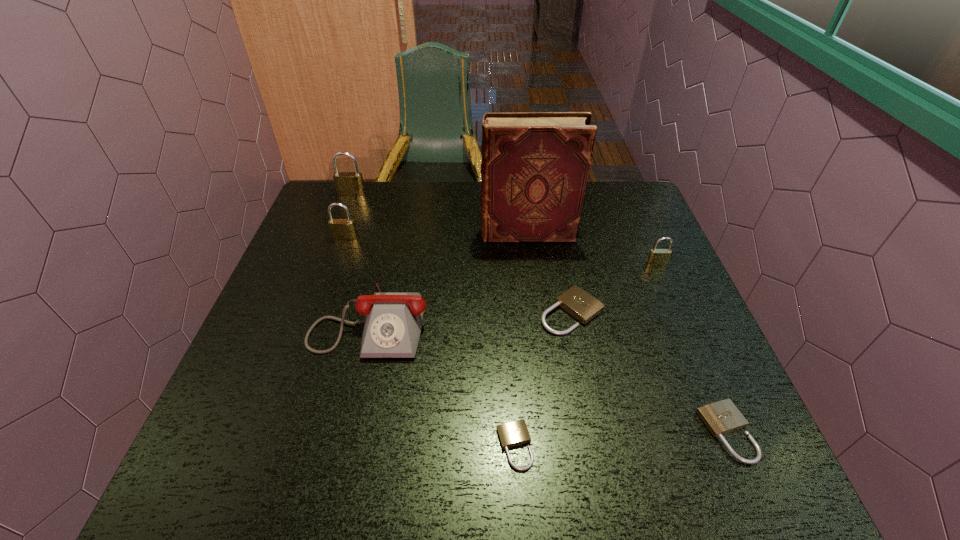
The height and width of the screenshot is (540, 960). In order to click on brass padlock that is the second closest to the biggest beige padlock in this screenshot , I will do `click(341, 229)`.

Find the location of a particular element. This screenshot has width=960, height=540. brass padlock that is the nearest to the red telephone is located at coordinates (341, 229).

Locate which beige padlock is the second closest to the biggest beige padlock. Please provide its 2D coordinates. Your answer should be formatted as a tuple, i.e. [(x, y)], where the tuple contains the x and y coordinates of a point satisfying the conditions above.

[(515, 433)]

Where is `beige padlock that can be found as the third closest to the farthest padlock`? beige padlock that can be found as the third closest to the farthest padlock is located at coordinates (721, 417).

The height and width of the screenshot is (540, 960). I want to click on vacant point that satisfies the following two spatial constraints: 1. on the spine side of the tallest object; 2. on the left side of the third shortest object, so click(537, 312).

This screenshot has width=960, height=540. In order to click on vacant space that satisfies the following two spatial constraints: 1. on the front-facing side of the farthest beige padlock; 2. on the right side of the biggest brass padlock in this screenshot , I will do (x=308, y=312).

Identify the location of free space that satisfies the following two spatial constraints: 1. on the front-facing side of the farthest padlock; 2. on the left side of the shortest object. Image resolution: width=960 pixels, height=540 pixels. (258, 446).

This screenshot has height=540, width=960. In order to click on free point that satisfies the following two spatial constraints: 1. on the spine side of the fifth tallest padlock; 2. on the right side of the hardback book in this screenshot , I will do `click(552, 433)`.

The image size is (960, 540). I want to click on free location that satisfies the following two spatial constraints: 1. on the dial of the second smallest beige padlock; 2. on the left side of the red telephone, so click(345, 433).